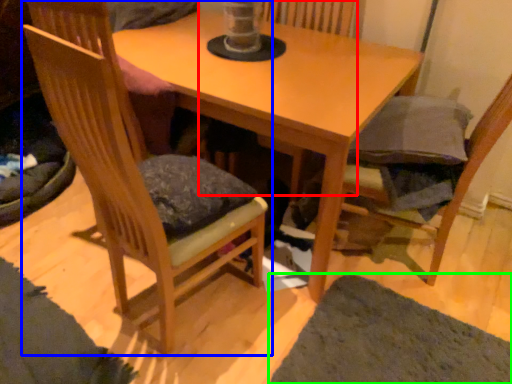
Question: Which object is positioned farthest from swivel chair (highlighted by a red box)? Select from chair (highlighted by a blue box) and mat (highlighted by a green box).

Choices:
 (A) chair
 (B) mat

Answer: (B)